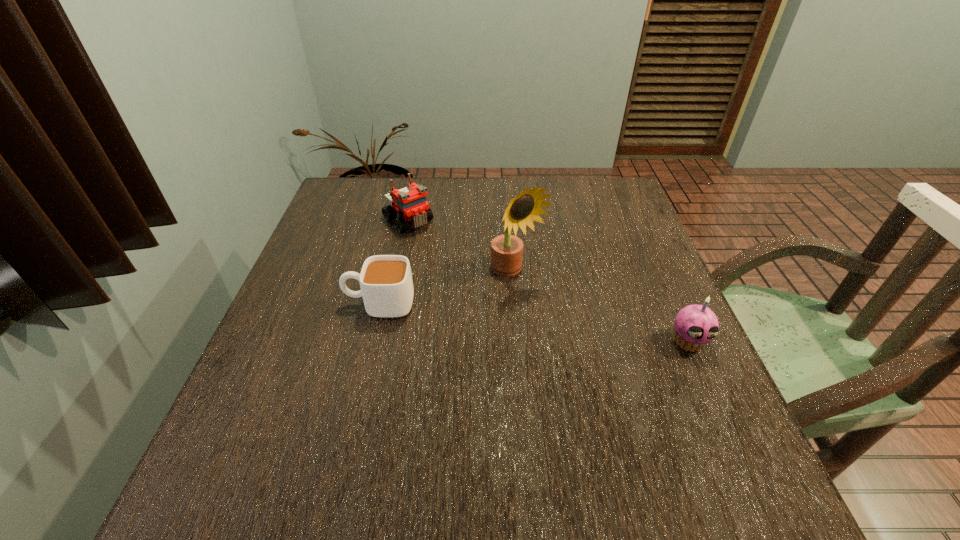
Where is `vacant space situated 0.200m on the front-facing side of the Lego`? Image resolution: width=960 pixels, height=540 pixels. vacant space situated 0.200m on the front-facing side of the Lego is located at coordinates (464, 271).

Locate an element on the screen. free space located on the front-facing side of the Lego is located at coordinates (452, 260).

Where is `vacant space located 0.100m on the front-facing side of the Lego`? vacant space located 0.100m on the front-facing side of the Lego is located at coordinates (442, 251).

You are a GUI agent. You are given a task and a screenshot of the screen. Output one action in this format:
    pyautogui.click(x=<x>, y=<y>)
    Task: Click on the blank area located on the face of the tallest object
    
    Given the screenshot: What is the action you would take?
    pyautogui.click(x=583, y=341)

Where is `blank space located 0.380m on the face of the tallest object`? This screenshot has height=540, width=960. blank space located 0.380m on the face of the tallest object is located at coordinates (655, 414).

Find the location of a particular element. This screenshot has height=540, width=960. free space located on the face of the tallest object is located at coordinates click(627, 386).

Locate an element on the screen. The height and width of the screenshot is (540, 960). object positioned at the far edge is located at coordinates (410, 203).

Identify the location of object that is positioned at the left edge. This screenshot has width=960, height=540. (386, 284).

You are a GUI agent. You are given a task and a screenshot of the screen. Output one action in this format:
    pyautogui.click(x=<x>, y=<y>)
    Task: Click on the object that is at the right edge
    
    Given the screenshot: What is the action you would take?
    pyautogui.click(x=695, y=325)

Locate an element on the screen. This screenshot has width=960, height=540. free space at the far edge is located at coordinates (472, 186).